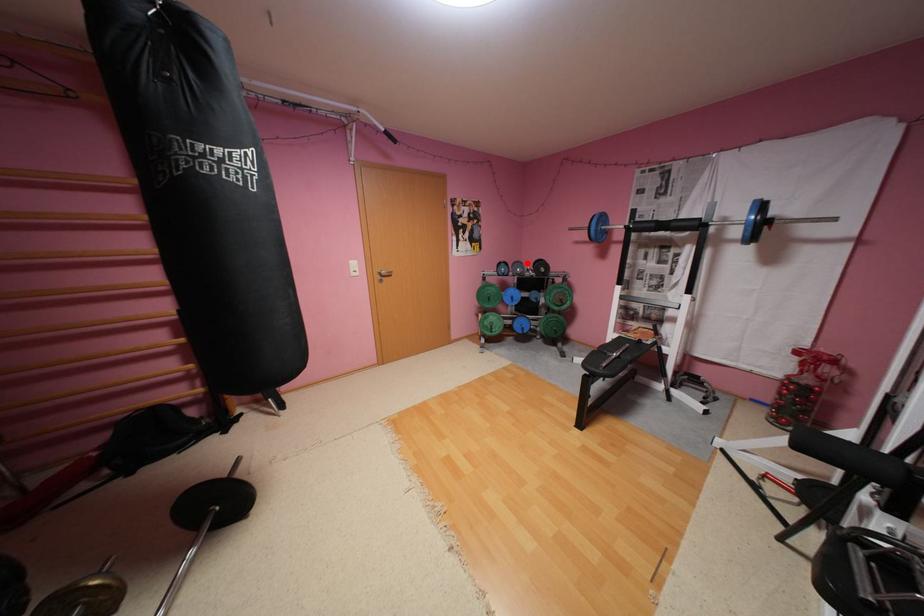
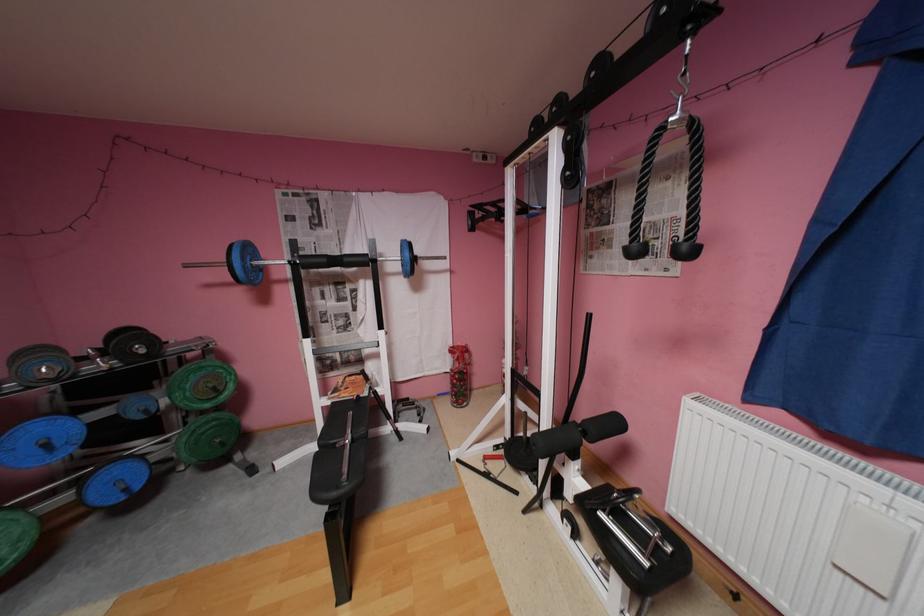
Question: I am providing you with two images of the same scene from different viewpoints. Image1 has a red point marked. In image2, the corresponding 3D location appears at what relative position? Reply with the corresponding letter.

Choices:
 (A) Closer
 (B) Farther

Answer: (B)